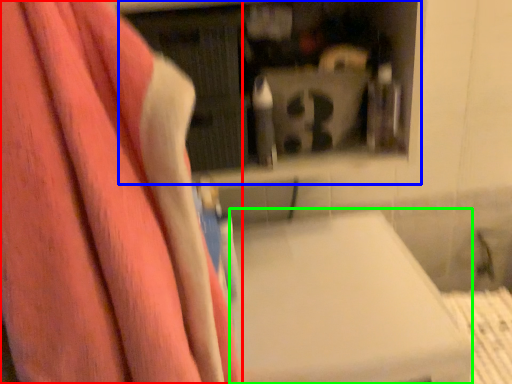
Question: Which object is positioned closest to towel (highlighted by a red box)? Select from shelf (highlighted by a blue box) and lift (highlighted by a green box).

Choices:
 (A) shelf
 (B) lift

Answer: (B)